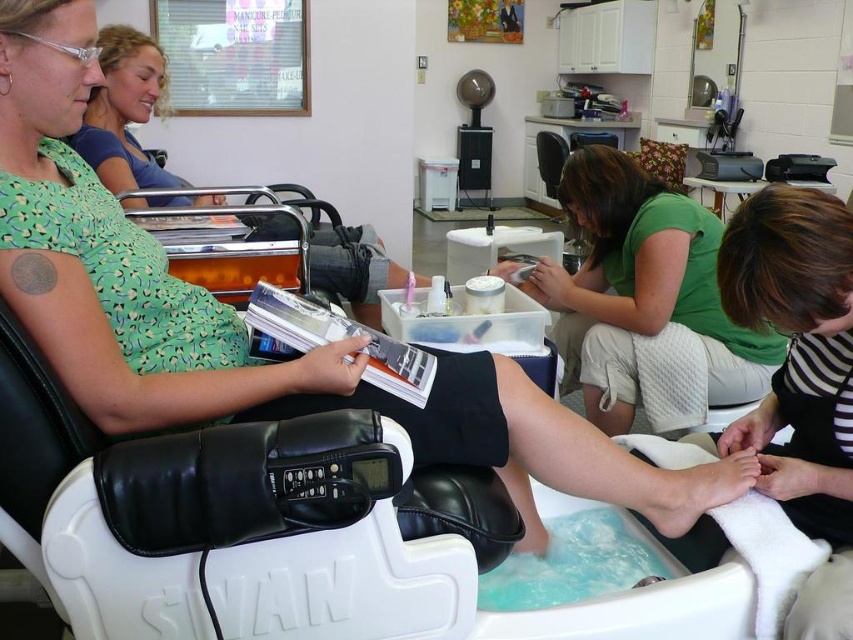
You are a customer in a nail salon and want to know where the pedicure chair is located. The pedicure chair is at the point with coordinates (647, 301). Is the pedicure chair located on the green matte shirt at center?

The point (647, 301) is on the green matte shirt at center, so yes, the pedicure chair is located on the green matte shirt at center.

You are a customer in the nail salon and want to choose between the green matte shirt at center and the green matte dress at upper left. Which one takes up more space in the image?

The green matte dress at upper left takes up more space in the image than the green matte shirt at center because the green matte shirt at center occupies less space than green matte dress at upper left.